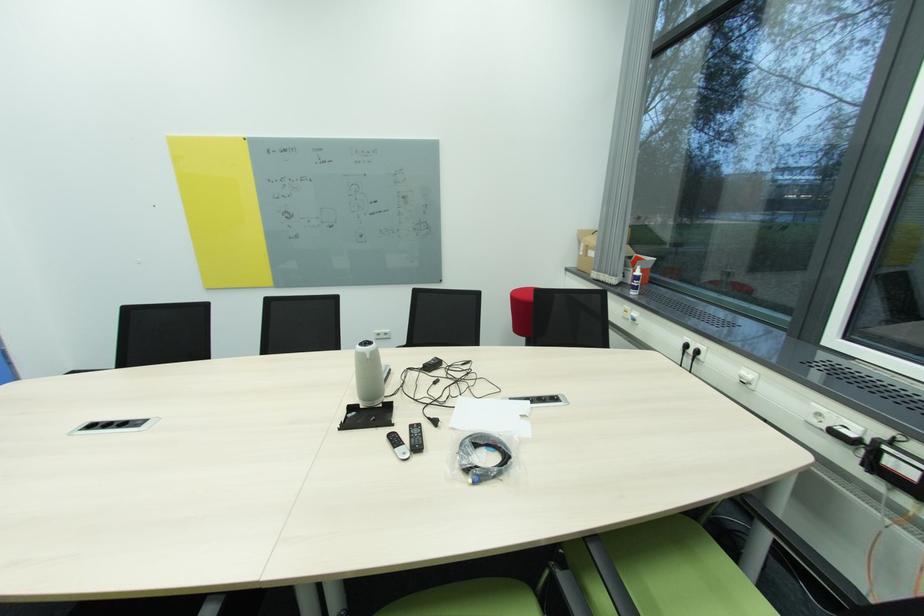
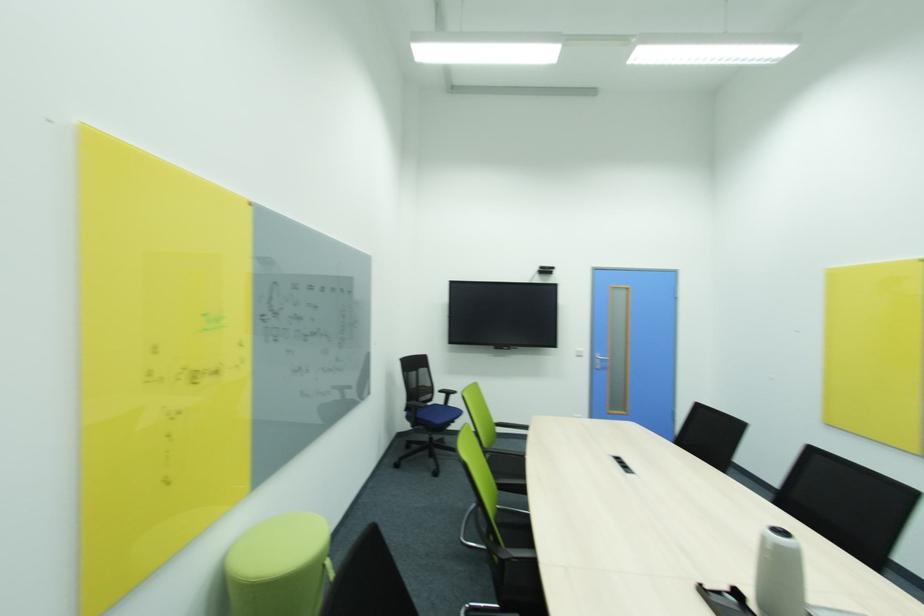
Where in the second image is the point corresponding to point 372,358 from the first image?

(774, 548)